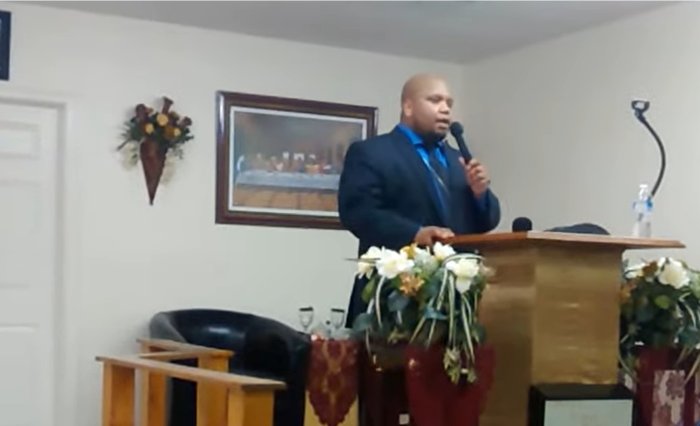
Locate an element on the screen. This screenshot has height=426, width=700. picture is located at coordinates (302, 172).